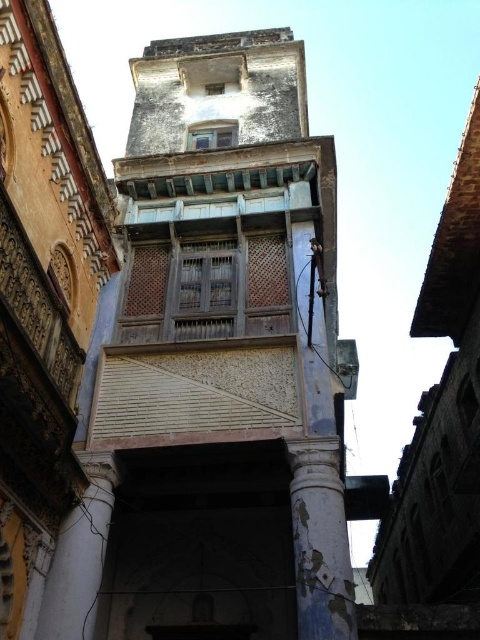
Question: Which point is farther to the camera?

Choices:
 (A) (321, 445)
 (B) (103, 552)

Answer: (A)

Question: Which of the following is the closest to the observer?

Choices:
 (A) peeling blue paint column at lower right
 (B) blue painted wood bell tower at center

Answer: (A)

Question: Can you confirm if peeling blue paint column at lower right is positioned below white marble pillar at lower left?

Choices:
 (A) no
 (B) yes

Answer: (A)

Question: Which point is closer to the camera?

Choices:
 (A) (108, 524)
 (B) (191, 467)
 (C) (348, 604)

Answer: (C)

Question: Does peeling blue paint column at lower right come behind white marble pillar at lower left?

Choices:
 (A) no
 (B) yes

Answer: (A)

Question: In this image, where is blue painted wood bell tower at center located relative to peeling blue paint column at lower right?

Choices:
 (A) below
 (B) above

Answer: (B)